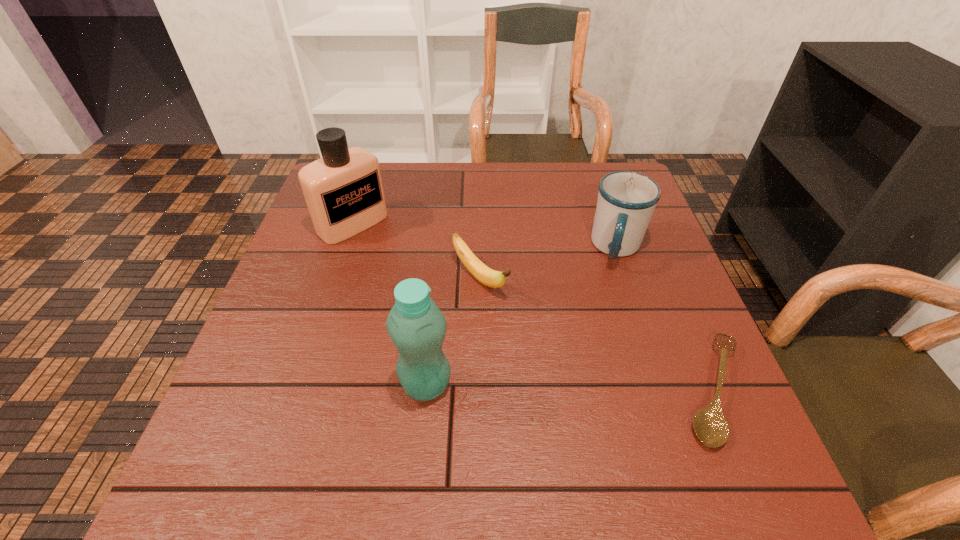
I want to click on object that stands as the second closest to the leftmost object, so click(x=417, y=327).

You are a GUI agent. You are given a task and a screenshot of the screen. Output one action in this format:
    pyautogui.click(x=<x>, y=<y>)
    Task: Click on the object that is the fourth closest to the banana
    Image resolution: width=960 pixels, height=540 pixels.
    Given the screenshot: What is the action you would take?
    [710, 425]

You are a GUI agent. You are given a task and a screenshot of the screen. Output one action in this format:
    pyautogui.click(x=<x>, y=<y>)
    Task: Click on the vacant area that satisfies the following two spatial constraints: 1. on the front side of the perfume; 2. on the right side of the mug
    The width and height of the screenshot is (960, 540).
    Given the screenshot: What is the action you would take?
    (x=346, y=248)

In order to click on vacant space that satisfies the following two spatial constraints: 1. on the front side of the shortest object; 2. on the left side of the mug in this screenshot , I will do `click(664, 390)`.

Find the location of a particular element. vacant point that satisfies the following two spatial constraints: 1. on the front side of the mug; 2. on the right side of the ladle is located at coordinates (664, 390).